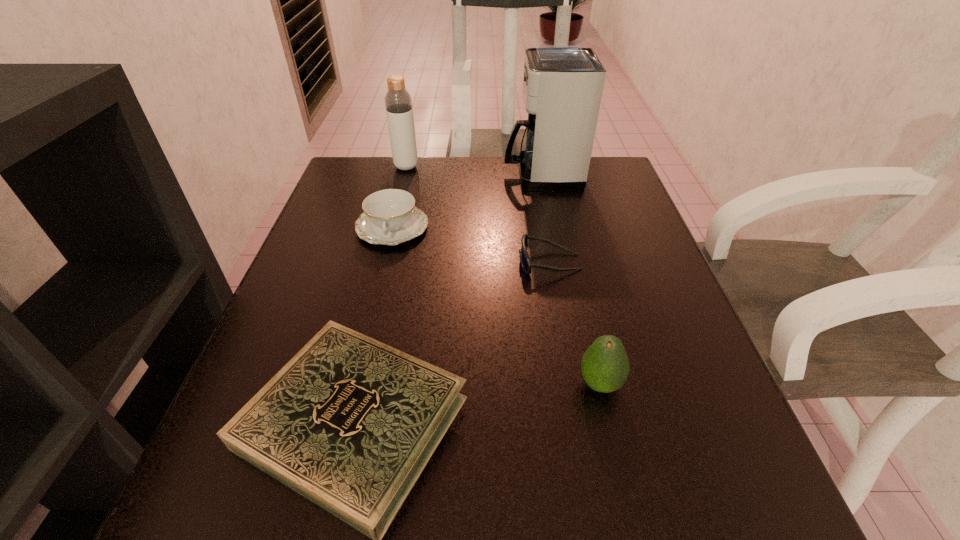
The height and width of the screenshot is (540, 960). I want to click on object located in the far left corner section of the desktop, so click(x=398, y=103).

In order to click on object that is at the far right corner in this screenshot , I will do `click(562, 84)`.

The height and width of the screenshot is (540, 960). I want to click on free space at the far edge of the desktop, so click(465, 158).

Locate an element on the screen. vacant space at the near edge of the desktop is located at coordinates (488, 480).

The image size is (960, 540). I want to click on vacant point at the left edge, so click(x=279, y=364).

Where is `vacant space at the right edge`? vacant space at the right edge is located at coordinates (619, 274).

The image size is (960, 540). In the image, there is a desktop. What are the coordinates of `vacant space at the far left corner` in the screenshot? It's located at (341, 200).

Locate an element on the screen. This screenshot has height=540, width=960. blank space at the far right corner of the desktop is located at coordinates (587, 192).

This screenshot has height=540, width=960. In the image, there is a desktop. What are the coordinates of `vacant area at the near right corner` in the screenshot? It's located at (687, 516).

The image size is (960, 540). I want to click on vacant space in between the fourth tallest object and the avocado, so click(x=496, y=306).